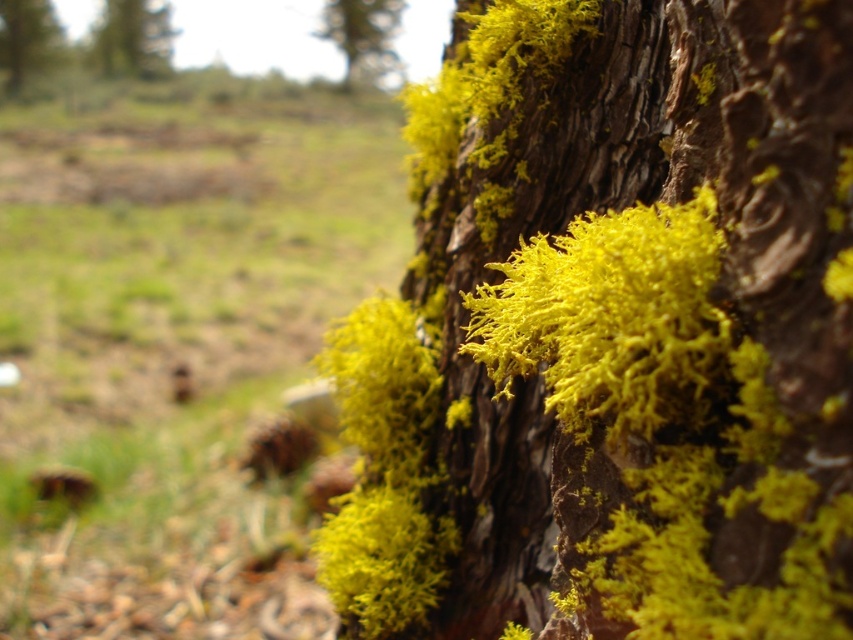
Question: Does yellow fuzzy moss at upper left have a greater width compared to yellow mossy bark at upper center?

Choices:
 (A) yes
 (B) no

Answer: (A)

Question: Among these objects, which one is farthest from the camera?

Choices:
 (A) yellow mossy bark at upper left
 (B) yellow mossy bark at upper center
 (C) yellow fuzzy moss at upper left

Answer: (A)

Question: Based on their relative distances, which object is farther from the yellow fuzzy moss at upper left?

Choices:
 (A) yellow mossy bark at upper left
 (B) yellow mossy bark at upper center

Answer: (B)

Question: Does yellow fuzzy moss at upper left appear on the right side of yellow mossy bark at upper left?

Choices:
 (A) no
 (B) yes

Answer: (B)

Question: Among these points, which one is nearest to the camera?

Choices:
 (A) (28, 22)
 (B) (349, 10)
 (C) (107, 67)

Answer: (C)

Question: Can you confirm if yellow fuzzy moss at upper left is thinner than yellow mossy bark at upper left?

Choices:
 (A) no
 (B) yes

Answer: (A)